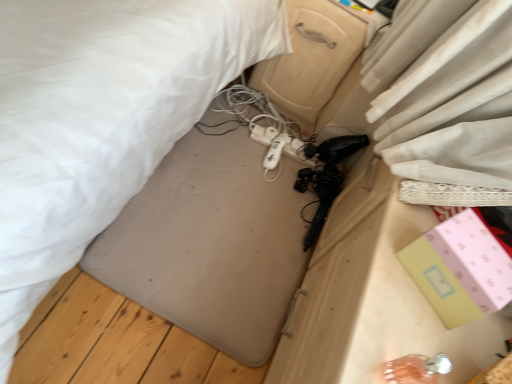
This screenshot has width=512, height=384. What do you see at coordinates (101, 117) in the screenshot?
I see `white fabric bed at center` at bounding box center [101, 117].

The height and width of the screenshot is (384, 512). I want to click on beige plastic drawer at center, so click(x=311, y=58).

The width and height of the screenshot is (512, 384). What do you see at coordinates (275, 152) in the screenshot? I see `white plastic hairdryer at center` at bounding box center [275, 152].

You are a GUI agent. You are given a task and a screenshot of the screen. Output one action in this format:
    pyautogui.click(x=<x>, y=<y>)
    Task: Click on the white plastic extension cord at center
    The width and height of the screenshot is (512, 384).
    Given the screenshot: What is the action you would take?
    pyautogui.click(x=280, y=144)

Describe the element at coordinates (460, 269) in the screenshot. I see `pink paper box at lower right` at that location.

This screenshot has height=384, width=512. I want to click on pink paper box at lower right, so click(460, 269).

At what (x,y) coordinates should I click in order to perform the action: click on white fabric bed at center. Please return your answer as a coordinate pair (x, y). Looking at the image, I should click on (101, 117).

Is white fabric bed at center oriented towards white plastic hairdryer at center?

No, white fabric bed at center is not turned towards white plastic hairdryer at center.

Is point (5, 281) positioned behind point (284, 136)?

That is False.

Is white fabric bed at center positioned beyond the bounds of white plastic extension cord at center?

That's correct, white fabric bed at center is outside of white plastic extension cord at center.

Between white fabric bed at center and white plastic extension cord at center, which one has more height?

With more height is white fabric bed at center.

In the image, is white fabric bed at center positioned in front of or behind white plastic extension cord at center?

white fabric bed at center is in front of white plastic extension cord at center.

Is white fabric bed at center bigger than white plastic extension cord at center?

Correct, white fabric bed at center is larger in size than white plastic extension cord at center.

From the image's perspective, which one is positioned higher, pink paper box at lower right or beige plastic drawer at center?

beige plastic drawer at center.

Which point is more forward, (x=470, y=273) or (x=283, y=62)?

The point (x=470, y=273) is closer to the camera.

Considering the relative sizes of pink paper box at lower right and beige plastic drawer at center in the image provided, is pink paper box at lower right smaller than beige plastic drawer at center?

Correct, pink paper box at lower right occupies less space than beige plastic drawer at center.

Is pink paper box at lower right inside the boundaries of beige plastic drawer at center, or outside?

pink paper box at lower right cannot be found inside beige plastic drawer at center.

Is white plastic hairdryer at center positioned far away from white fabric bed at center?

No, white plastic hairdryer at center is not far from white fabric bed at center.

From the picture: Does white plastic hairdryer at center turn towards white fabric bed at center?

No, white plastic hairdryer at center is not oriented towards white fabric bed at center.

The width and height of the screenshot is (512, 384). I want to click on bed above the white plastic hairdryer at center (from a real-world perspective), so click(x=101, y=117).

Based on the photo, from a real-world perspective, is white plastic hairdryer at center on top of white fabric bed at center?

No, from a real-world perspective, white plastic hairdryer at center is not above white fabric bed at center.

Considering the sizes of beige plastic drawer at center and white fabric bed at center in the image, is beige plastic drawer at center bigger or smaller than white fabric bed at center?

Clearly, beige plastic drawer at center is smaller in size than white fabric bed at center.

Is beige plastic drawer at center positioned with its back to white fabric bed at center?

No.

Between point (295, 44) and point (83, 19), which one is positioned in front?

Positioned in front is point (83, 19).

The image size is (512, 384). In order to click on box to the right of white fabric bed at center in this screenshot , I will do `click(460, 269)`.

From the image's perspective, is white fabric bed at center on pink paper box at lower right?

Correct, white fabric bed at center appears higher than pink paper box at lower right in the image.

Which of these two, white fabric bed at center or pink paper box at lower right, stands shorter?

pink paper box at lower right.

Does white plastic extension cord at center have a lesser height compared to beige plastic drawer at center?

Yes.

Which of these two, white plastic extension cord at center or beige plastic drawer at center, is thinner?

With smaller width is white plastic extension cord at center.

Based on the photo, is white plastic extension cord at center not near beige plastic drawer at center?

No, there isn't a large distance between white plastic extension cord at center and beige plastic drawer at center.

Is white plastic extension cord at center facing towards beige plastic drawer at center?

No, white plastic extension cord at center is not aimed at beige plastic drawer at center.

Identify the location of equipment below the white fabric bed at center (from the image's perspective). The width and height of the screenshot is (512, 384). (275, 152).

Where is `extension cord that is on the right side of white fabric bed at center`? extension cord that is on the right side of white fabric bed at center is located at coordinates pos(280,144).

Based on the photo, looking at the image, which one is located further to beige plastic drawer at center, white fabric bed at center or white plastic extension cord at center?

white fabric bed at center is positioned further to the anchor beige plastic drawer at center.

Based on their spatial positions, is beige plastic drawer at center or white plastic hairdryer at center further from white plastic extension cord at center?

beige plastic drawer at center.

In the scene shown: Considering their positions, is pink paper box at lower right positioned closer to beige plastic drawer at center than white plastic hairdryer at center?

white plastic hairdryer at center is positioned closer to the anchor beige plastic drawer at center.

Based on their spatial positions, is white plastic hairdryer at center or beige plastic drawer at center closer to white plastic extension cord at center?

The object closer to white plastic extension cord at center is white plastic hairdryer at center.

Estimate the real-world distances between objects in this image. Which object is further from beige plastic drawer at center, pink paper box at lower right or white fabric bed at center?

The object further to beige plastic drawer at center is pink paper box at lower right.

From the picture: When comparing their distances from white plastic hairdryer at center, does white fabric bed at center or white plastic extension cord at center seem further?

white fabric bed at center is positioned further to the anchor white plastic hairdryer at center.

Looking at this image, which object lies further to the anchor point pink paper box at lower right, white plastic extension cord at center or white fabric bed at center?

white plastic extension cord at center.

Considering their positions, is white plastic extension cord at center positioned further to pink paper box at lower right than white plastic hairdryer at center?

white plastic extension cord at center is positioned further to the anchor pink paper box at lower right.

Where is `box between white fabric bed at center and white plastic extension cord at center from front to back`? box between white fabric bed at center and white plastic extension cord at center from front to back is located at coordinates (460, 269).

Find the location of `box located between white fabric bed at center and white plastic hairdryer at center in the depth direction`. box located between white fabric bed at center and white plastic hairdryer at center in the depth direction is located at coordinates (460, 269).

Find the location of a particular element. The height and width of the screenshot is (384, 512). drawer located between white fabric bed at center and white plastic extension cord at center in the depth direction is located at coordinates (311, 58).

In order to click on drawer between pink paper box at lower right and white plastic hairdryer at center from front to back in this screenshot , I will do point(311,58).